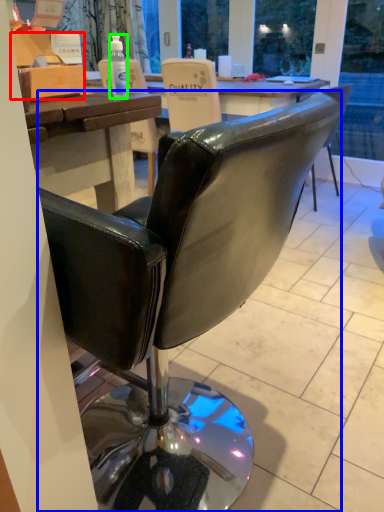
Question: Which object is the closest to the box (highlighted by a red box)? Choose among these: chair (highlighted by a blue box) or bottle (highlighted by a green box).

Choices:
 (A) chair
 (B) bottle

Answer: (B)